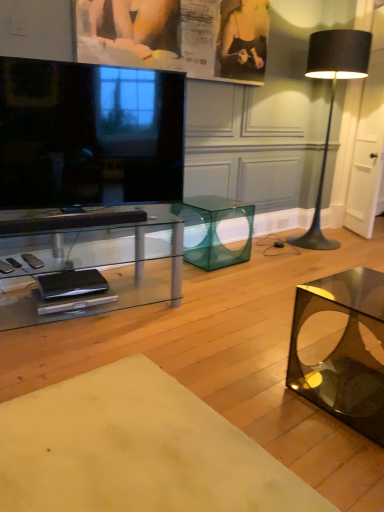
Question: Which direction should I rotate to look at transparent glass cube at center, which appears as the third table when viewed from the front, — up or down?

Choices:
 (A) down
 (B) up

Answer: (B)

Question: From a real-world perspective, does transparent glass cube at center, which is the first table from back to front, stand above matte paper poster at upper center?

Choices:
 (A) no
 (B) yes

Answer: (A)

Question: From the image's perspective, is transparent glass cube at center, which is the first table from back to front, under matte paper poster at upper center?

Choices:
 (A) yes
 (B) no

Answer: (A)

Question: Does transparent glass cube at center, which is the first table from back to front, touch matte paper poster at upper center?

Choices:
 (A) yes
 (B) no

Answer: (B)

Question: Is transparent glass cube at center, which is the first table from back to front, located outside matte paper poster at upper center?

Choices:
 (A) yes
 (B) no

Answer: (A)

Question: Considering the relative sizes of transparent glass cube at center, which is the first table from back to front, and matte paper poster at upper center in the image provided, is transparent glass cube at center, which is the first table from back to front, wider than matte paper poster at upper center?

Choices:
 (A) yes
 (B) no

Answer: (A)

Question: Considering the relative sizes of transparent glass cube at center, which is the first table from back to front, and matte paper poster at upper center in the image provided, is transparent glass cube at center, which is the first table from back to front, smaller than matte paper poster at upper center?

Choices:
 (A) yes
 (B) no

Answer: (B)

Question: Does polished black glass cube at lower right have a lesser height compared to smooth cream fabric at lower center, the 1th table when ordered from front to back?

Choices:
 (A) yes
 (B) no

Answer: (B)

Question: Considering the relative sizes of polished black glass cube at lower right and smooth cream fabric at lower center, acting as the 3th table starting from the back, in the image provided, is polished black glass cube at lower right wider than smooth cream fabric at lower center, acting as the 3th table starting from the back,?

Choices:
 (A) yes
 (B) no

Answer: (B)

Question: From a real-world perspective, does polished black glass cube at lower right sit lower than smooth cream fabric at lower center, the 1th table when ordered from front to back?

Choices:
 (A) no
 (B) yes

Answer: (A)

Question: Is polished black glass cube at lower right positioned behind smooth cream fabric at lower center, acting as the 3th table starting from the back?

Choices:
 (A) yes
 (B) no

Answer: (A)

Question: Is polished black glass cube at lower right outside smooth cream fabric at lower center, acting as the 3th table starting from the back?

Choices:
 (A) no
 (B) yes

Answer: (B)

Question: From the image's perspective, is polished black glass cube at lower right under smooth cream fabric at lower center, acting as the 3th table starting from the back?

Choices:
 (A) no
 (B) yes

Answer: (A)

Question: From a real-world perspective, is black matte floor lamp at right located beneath clear glass table at center, the second table positioned from the front?

Choices:
 (A) no
 (B) yes

Answer: (A)